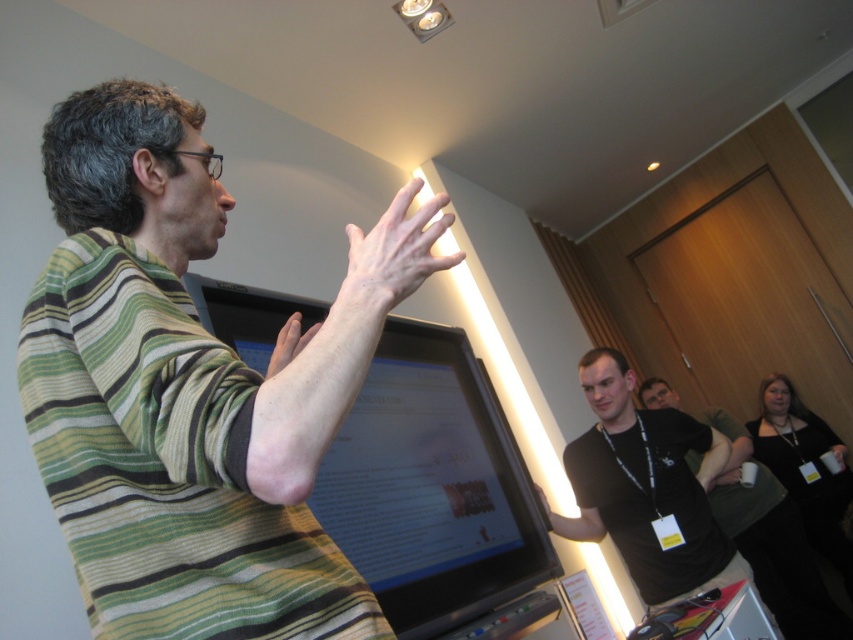
Does pale skin/hair at upper center come behind matte black hand at center?

No, pale skin/hair at upper center is in front of matte black hand at center.

Can you confirm if pale skin/hair at upper center is taller than matte black hand at center?

Indeed, pale skin/hair at upper center has a greater height compared to matte black hand at center.

This screenshot has height=640, width=853. I want to click on pale skin/hair at upper center, so click(x=392, y=257).

Can you confirm if pale skin/hair at upper center is shorter than matte skin hand at upper center?

No, pale skin/hair at upper center is not shorter than matte skin hand at upper center.

Who is higher up, pale skin/hair at upper center or matte skin hand at upper center?

pale skin/hair at upper center is above.

Image resolution: width=853 pixels, height=640 pixels. I want to click on pale skin/hair at upper center, so click(x=392, y=257).

Is point (801, 572) closer to viewer compared to point (531, 484)?

No, it is not.

What do you see at coordinates (769, 538) in the screenshot?
I see `black fabric shirt at lower right` at bounding box center [769, 538].

Is point (773, 486) positioned after point (547, 513)?

Yes, point (773, 486) is farther from viewer.

I want to click on black fabric shirt at lower right, so click(769, 538).